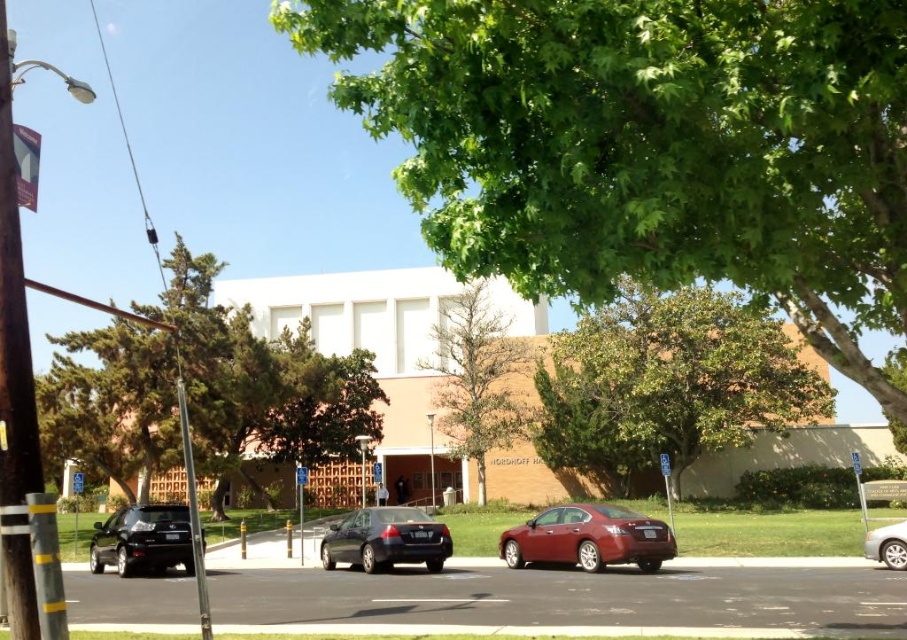
Is green leafy tree at left wider than green leafy tree at center?

No, green leafy tree at left is not wider than green leafy tree at center.

Is point (179, 257) in front of point (802, 404)?

Yes, point (179, 257) is in front of point (802, 404).

Is point (200, 403) closer to viewer compared to point (701, 392)?

Yes.

Locate an element on the screen. The image size is (907, 640). green leafy tree at left is located at coordinates (203, 390).

Can you confirm if green leafy tree at center is smaller than shiny red sedan at center?

No.

Which is in front, point (537, 374) or point (600, 561)?

Point (600, 561) is more forward.

Is point (668, 380) behind point (577, 512)?

Yes, point (668, 380) is behind point (577, 512).

Where is `green leafy tree at center`? The width and height of the screenshot is (907, 640). green leafy tree at center is located at coordinates (667, 385).

Is green leafy tree at left above shiny black sedan at lower left?

Indeed, green leafy tree at left is positioned over shiny black sedan at lower left.

Is point (293, 417) more distant than point (172, 566)?

Yes.

Image resolution: width=907 pixels, height=640 pixels. Describe the element at coordinates (203, 390) in the screenshot. I see `green leafy tree at left` at that location.

Find the location of `green leafy tree at left`. green leafy tree at left is located at coordinates [203, 390].